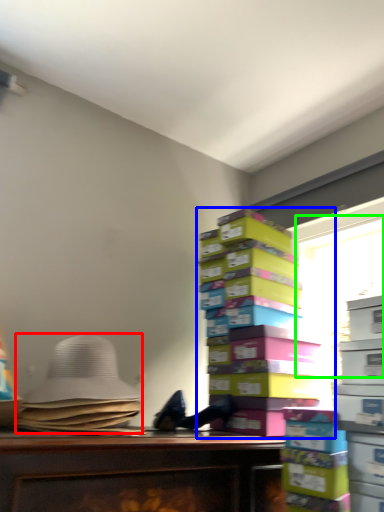
Question: Which object is the closest to the wide (highlighted by a red box)? Choose among these: book (highlighted by a blue box) or window screen (highlighted by a green box).

Choices:
 (A) book
 (B) window screen

Answer: (A)